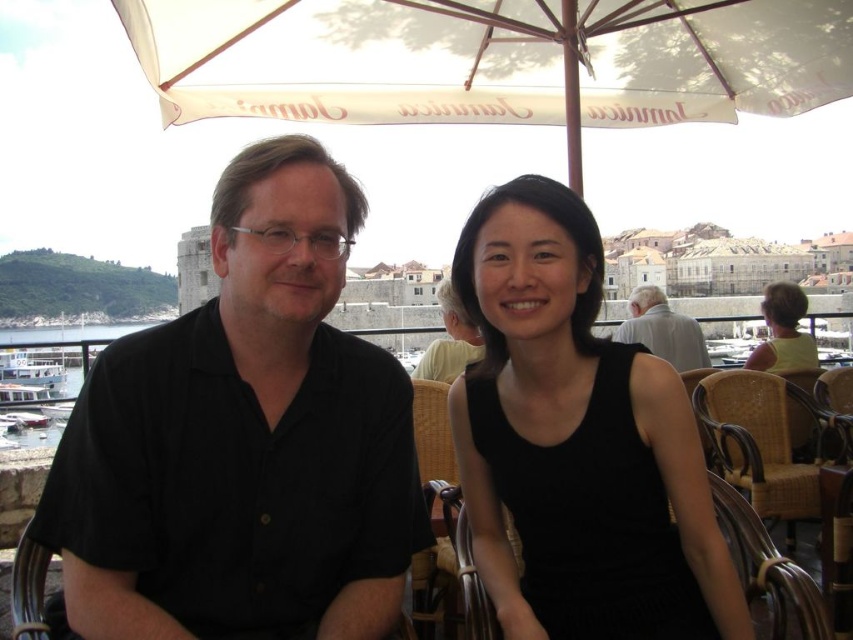
Question: Can you confirm if yellow fabric dress at right is positioned above matte black shirt at center?

Choices:
 (A) yes
 (B) no

Answer: (A)

Question: Is white fabric umbrella at upper center thinner than matte black shirt at center?

Choices:
 (A) yes
 (B) no

Answer: (B)

Question: Which is farther from the matte black shirt at center?

Choices:
 (A) black sleeveless dress at center
 (B) black shirt at left
 (C) gray fabric shirt at center

Answer: (B)

Question: Among these objects, which one is nearest to the camera?

Choices:
 (A) gray fabric shirt at center
 (B) black sleeveless dress at center

Answer: (B)

Question: Based on their relative distances, which object is farther from the yellow fabric dress at right?

Choices:
 (A) white fabric umbrella at upper center
 (B) black sleeveless dress at center
 (C) matte black shirt at center
 (D) black shirt at left

Answer: (D)

Question: Is white fabric umbrella at upper center above gray fabric shirt at center?

Choices:
 (A) yes
 (B) no

Answer: (A)